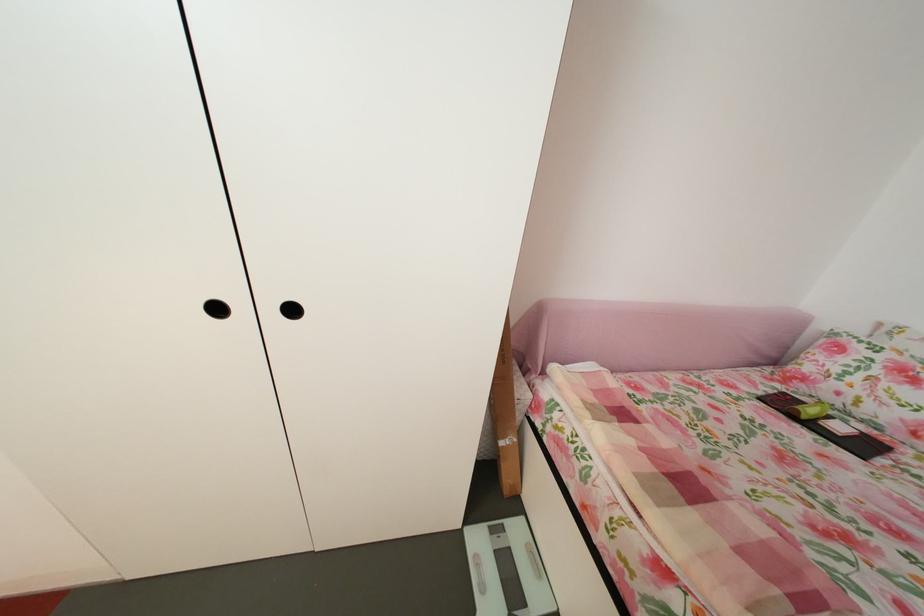
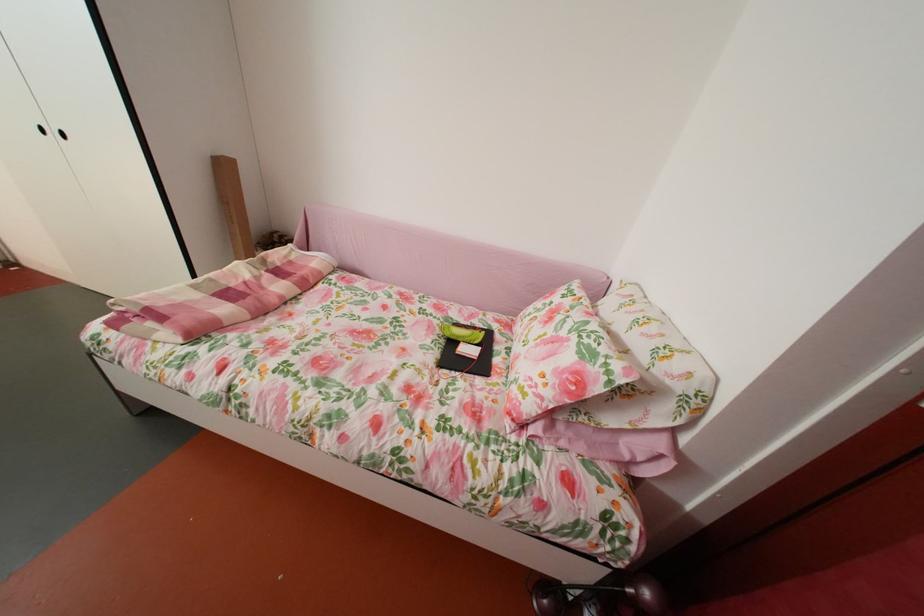
The point at (628,431) is marked in the first image. Where is the corresponding point in the second image?

(274, 278)